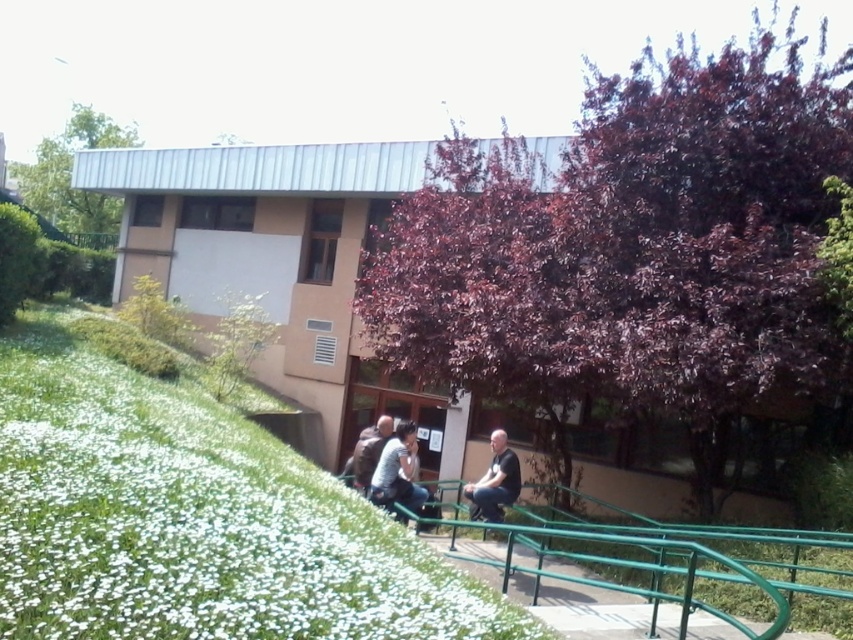
Question: Which object appears farthest from the camera in this image?

Choices:
 (A) dark gray jeans at center
 (B) brown leather jacket at center

Answer: (B)

Question: Considering the real-world distances, which object is farthest from the white soft grass at lower left?

Choices:
 (A) purple leafy tree at center
 (B) green leafy tree at upper left
 (C) brown leather jacket at center

Answer: (B)

Question: Does green leafy tree at upper left have a lesser width compared to dark gray jeans at center?

Choices:
 (A) yes
 (B) no

Answer: (B)

Question: Is the position of white soft grass at lower left less distant than that of green leafy tree at upper left?

Choices:
 (A) yes
 (B) no

Answer: (A)

Question: Which point is closer to the camera?

Choices:
 (A) green leafy tree at upper left
 (B) purple leafy tree at center
 (C) brown leather jacket at center
 (D) matte black shirt at center

Answer: (D)

Question: Can you confirm if white soft grass at lower left is positioned above brown leather jacket at center?

Choices:
 (A) yes
 (B) no

Answer: (A)